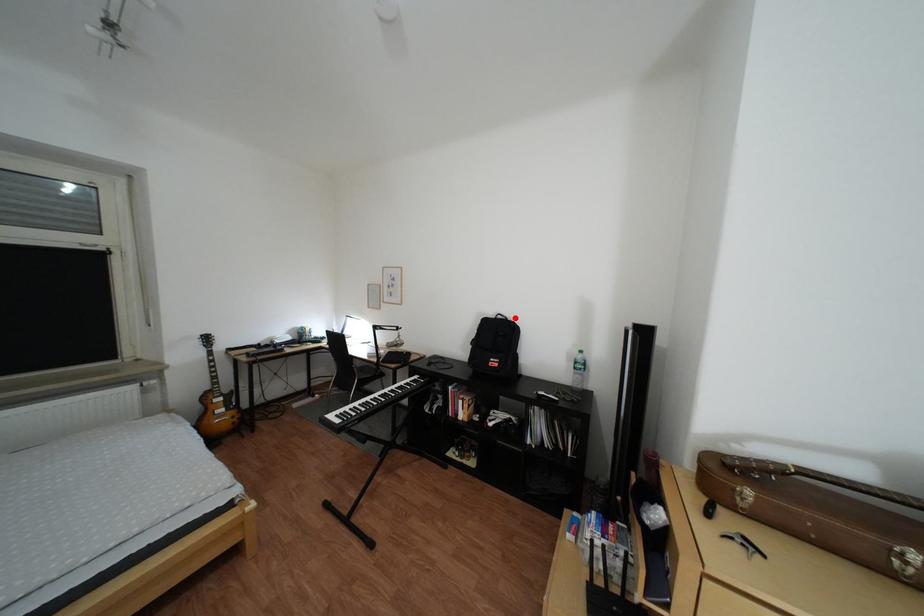
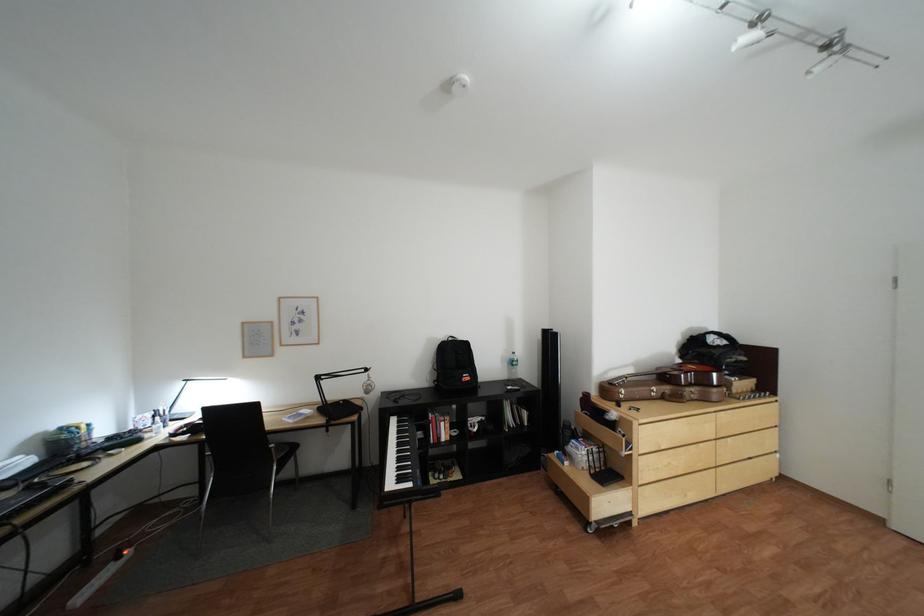
Locate, in the second image, the point that corresponds to the highlighted location in the first image.

(466, 339)